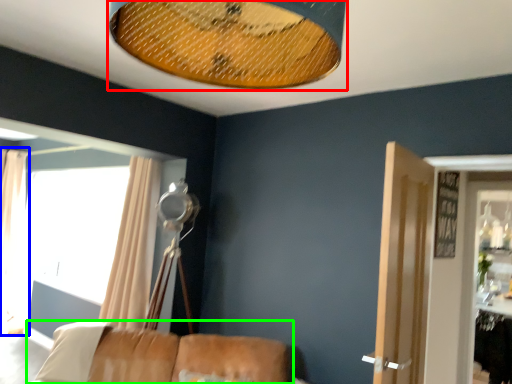
Question: Which is farther away from lamp (highlighted by a red box)? curtain (highlighted by a blue box) or furniture (highlighted by a green box)?

Choices:
 (A) curtain
 (B) furniture

Answer: (A)